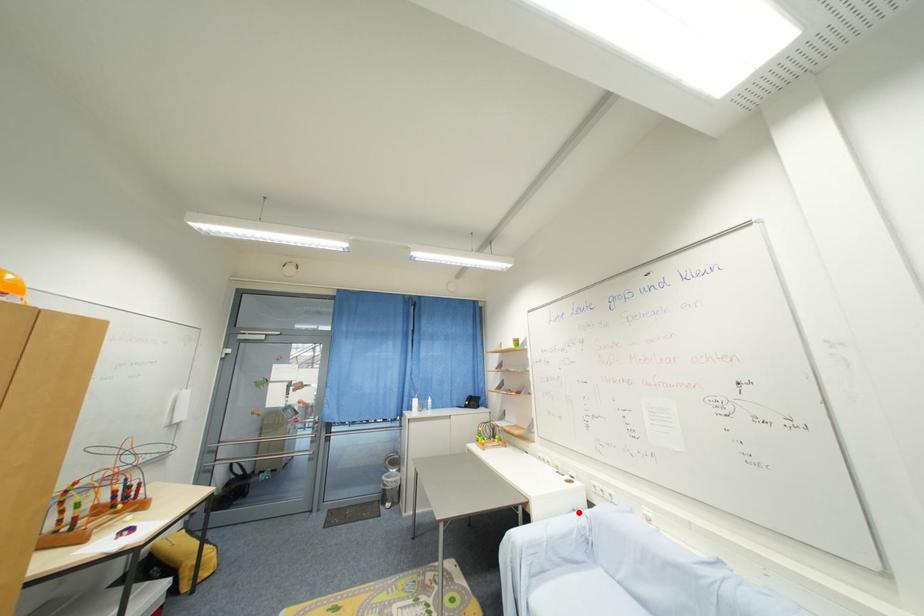
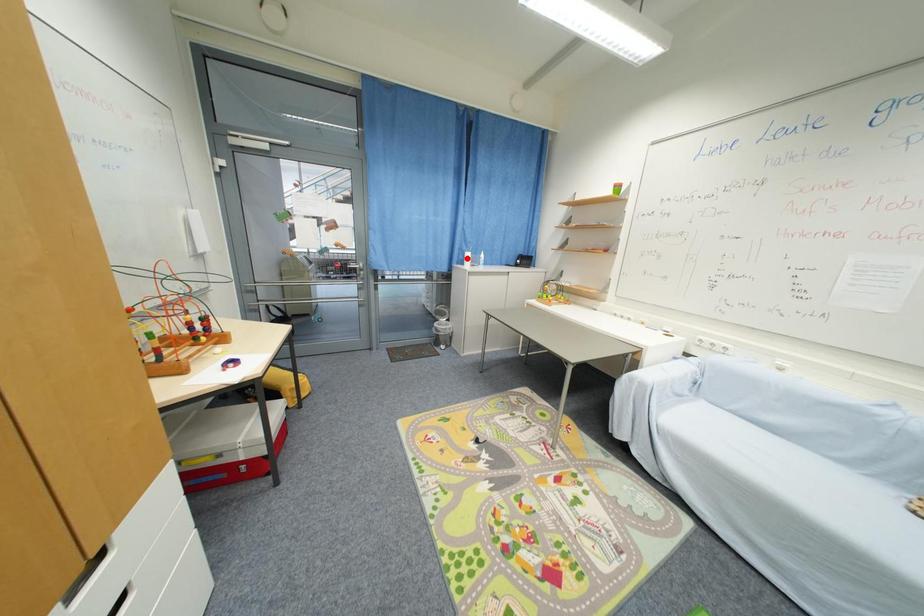
I am providing you with two images of the same scene from different viewpoints. A red point is marked on the first image and another point is marked on the second image. Do the highlighted points in image1 and image2 indicate the same real-world spot?

No